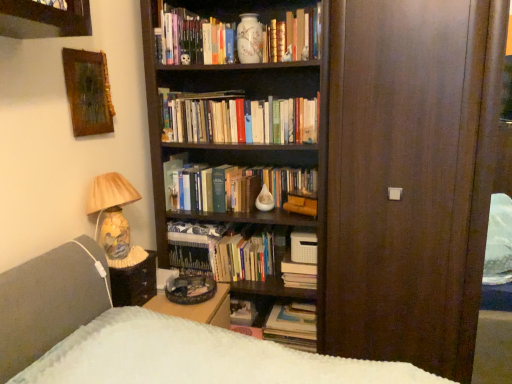
Question: From a real-world perspective, is hardcover book at lower center, which ranks as the 1th book in bottom-to-top order, physically located above or below matte ceramic lamp at left?

Choices:
 (A) below
 (B) above

Answer: (A)

Question: Is hardcover book at lower center, the seventh book positioned from the top, inside the boundaries of matte ceramic lamp at left, or outside?

Choices:
 (A) outside
 (B) inside

Answer: (A)

Question: Based on their relative distances, which object is farther from the hardcover book at lower center, the seventh book positioned from the top?

Choices:
 (A) matte ceramic vase at upper center, placed as the sixth book when sorted from bottom to top
 (B) wooden-framed painting at upper left
 (C) hardcover books at center, which is the second book from bottom to top
 (D) matte white vase at upper center, the 1th book from the top
 (E) brown wood door at center

Answer: (D)

Question: Which is nearer to the matte ceramic vase at upper center, which is counted as the 2th book, starting from the top?

Choices:
 (A) wooden-framed painting at upper left
 (B) hardcover book at center, arranged as the fifth book when viewed from the top
 (C) hardcover books at center, acting as the 3th book starting from the top
 (D) matte white vase at upper center, the 7th book from the bottom
 (E) brown wood door at center

Answer: (D)